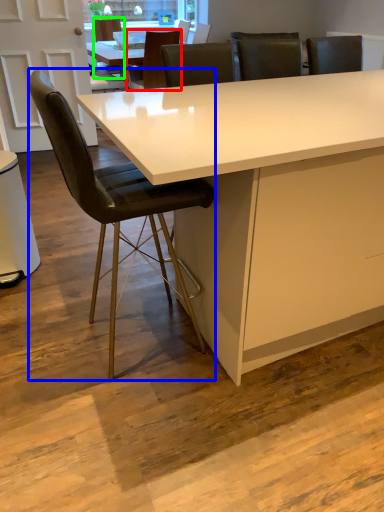
Question: Estimate the real-world distances between objects in this image. Which object is farther from chair (highlighted by a red box), chair (highlighted by a blue box) or chair (highlighted by a green box)?

Choices:
 (A) chair
 (B) chair

Answer: (A)